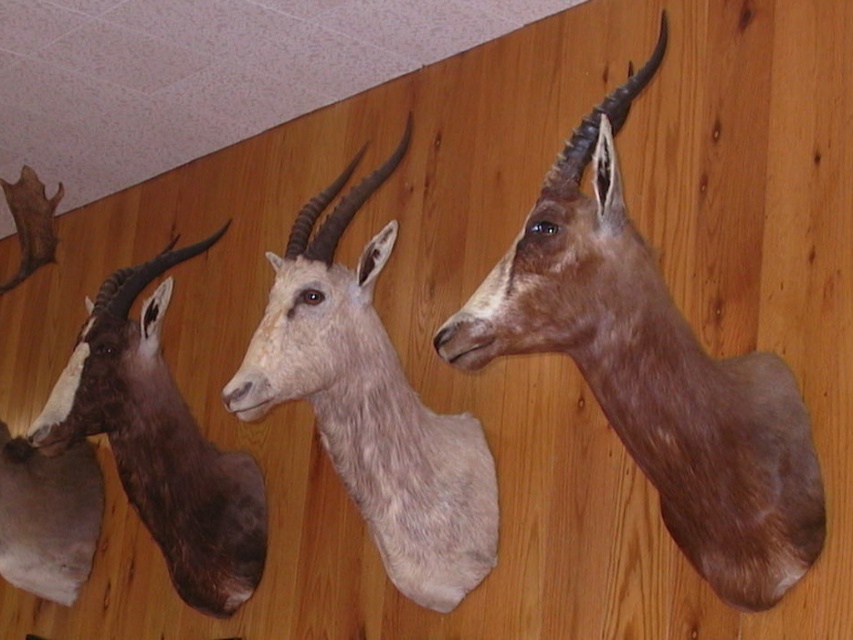
You are an interior designer planning to rearrange the mounted animal heads on the wooden wall. You want to place a new decorative item between the brown matte antelope head at center and the white matte antelope head at center. If the item requires 40 centimeters of space, will there be enough room?

The distance between the brown matte antelope head at center and the white matte antelope head at center is 41.77 centimeters. Since the required space is 40 centimeters, there is sufficient room to place the new decorative item between them.

You are standing in front of the mounted animal heads on the wooden wall. You notice two points marked on the wall. The first point is at coordinates point (317, 417) and the second is at point (67, 436). From your perspective, which point is closer to you?

Point (317, 417) is in front of point (67, 436), so it is closer to you.

You are an interior designer planning to add a new decorative item between the brown matte antelope at left and the white matte antelope head at center. The item you want to place is 18 inches wide. Will there be enough space between them to fit the item without moving either antelope head?

The distance between the brown matte antelope at left and the white matte antelope head at center is 19.56 inches. Since the item is 18 inches wide, there is enough space to fit it between them without moving either antelope head.